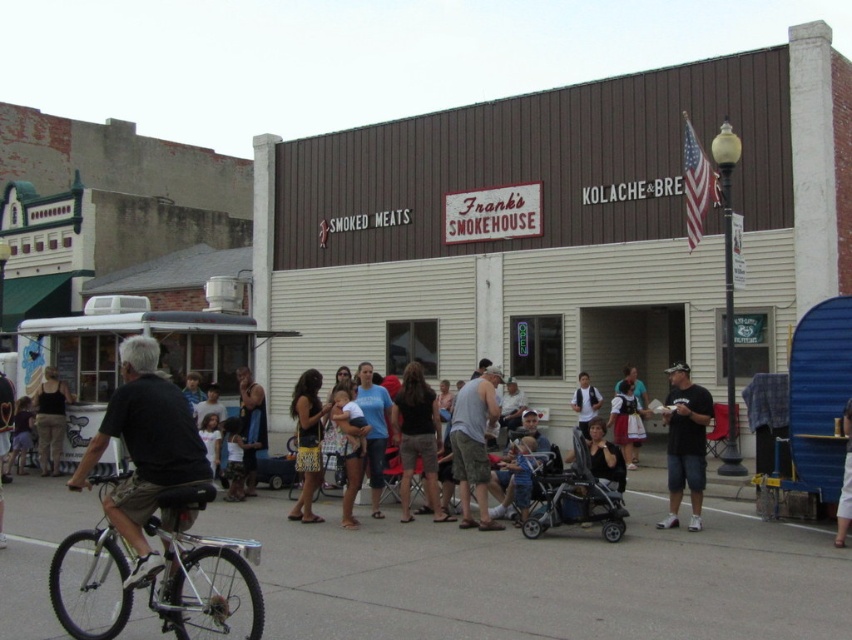
Is silver metallic bicycle at lower left wider than denim pants at center?

Yes.

Does point (205, 486) lie behind point (848, 460)?

That is False.

Find the location of `silver metallic bicycle at lower left`. silver metallic bicycle at lower left is located at coordinates (200, 570).

Does black matte shirt at left have a larger size compared to yellow floral dress at center?

Indeed, black matte shirt at left has a larger size compared to yellow floral dress at center.

Between point (121, 433) and point (314, 416), which one is positioned behind?

Positioned behind is point (314, 416).

Find the location of a particular element. black matte shirt at left is located at coordinates (144, 449).

Does silver metallic bicycle at lower left have a smaller size compared to black cotton shirt at lower right?

No.

Is silver metallic bicycle at lower left thinner than black cotton shirt at lower right?

No, silver metallic bicycle at lower left is not thinner than black cotton shirt at lower right.

Find the location of a particular element. The width and height of the screenshot is (852, 640). silver metallic bicycle at lower left is located at coordinates (200, 570).